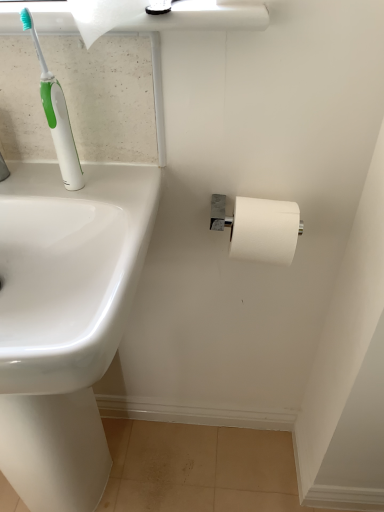
What are the coordinates of `free point to the right of green plastic toothbrush at upper left` in the screenshot? It's located at click(x=129, y=182).